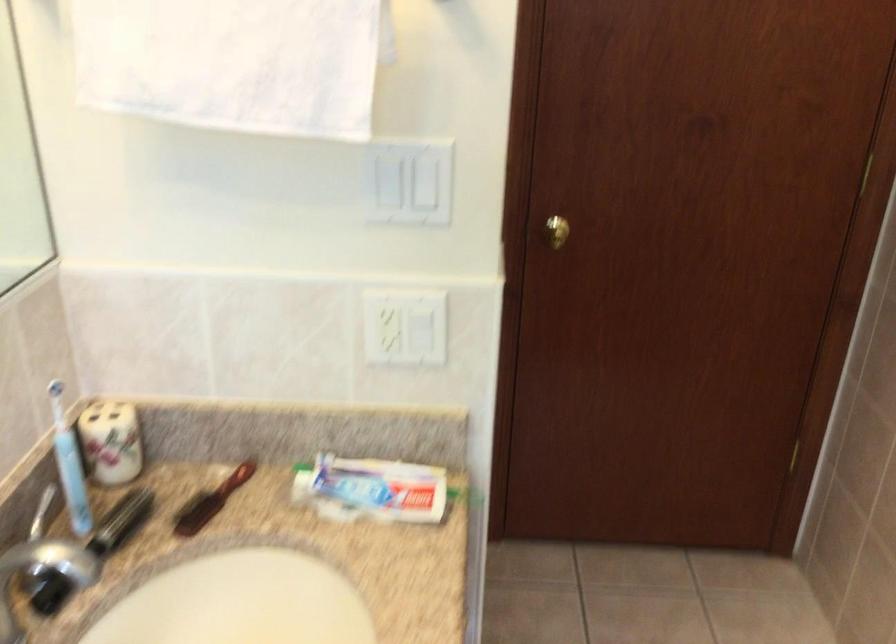
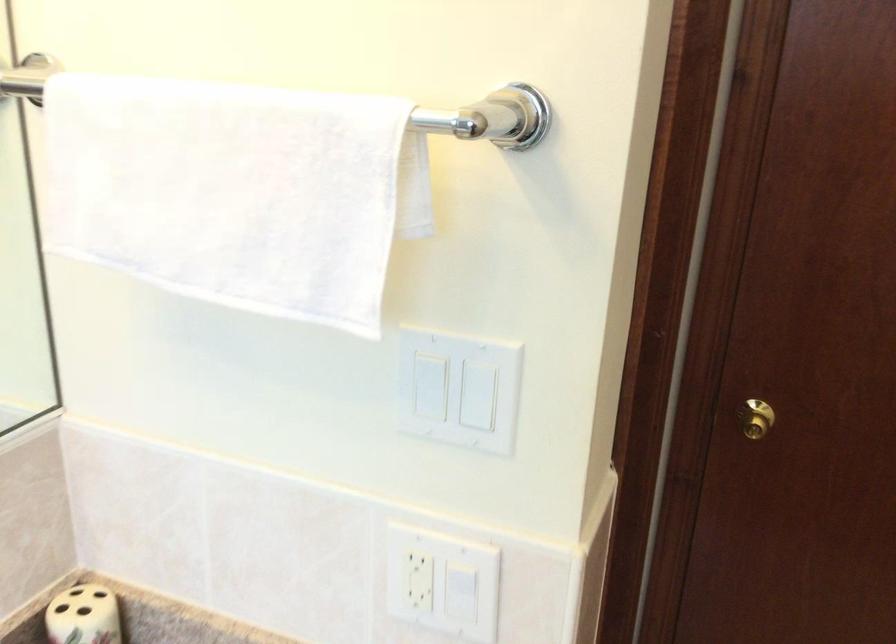
Question: How did the camera likely rotate?

Choices:
 (A) Left
 (B) Right
 (C) Up
 (D) Down

Answer: (A)